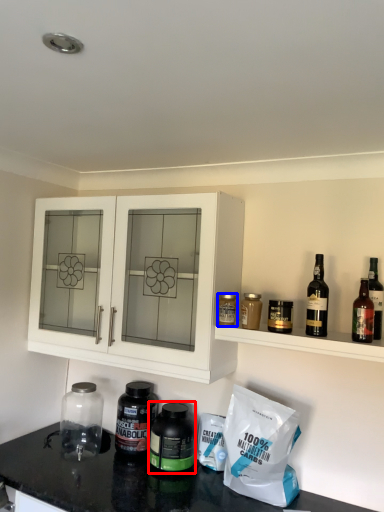
Question: Which object is further to the camera taking this photo, bottle (highlighted by a red box) or bottle (highlighted by a blue box)?

Choices:
 (A) bottle
 (B) bottle

Answer: (A)